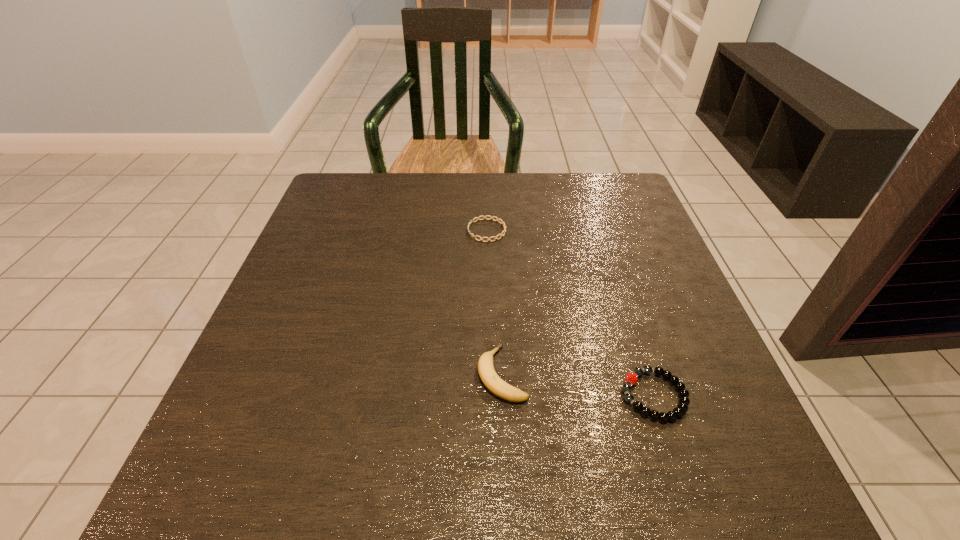
Identify the location of object at the far edge. Image resolution: width=960 pixels, height=540 pixels. (484, 217).

Where is `object that is at the right edge`? This screenshot has height=540, width=960. object that is at the right edge is located at coordinates (684, 401).

The width and height of the screenshot is (960, 540). In the image, there is a desktop. Find the location of `vacant space at the far edge`. vacant space at the far edge is located at coordinates (540, 177).

You are a GUI agent. You are given a task and a screenshot of the screen. Output one action in this format:
    pyautogui.click(x=<x>, y=<y>)
    Task: Click on the vacant space at the near edge
    
    Given the screenshot: What is the action you would take?
    pyautogui.click(x=400, y=454)

Locate an element on the screen. Image resolution: width=960 pixels, height=540 pixels. vacant space at the left edge is located at coordinates (299, 356).

Locate an element on the screen. vacant region at the right edge of the desktop is located at coordinates (693, 403).

Locate an element on the screen. The height and width of the screenshot is (540, 960). vacant space at the far left corner is located at coordinates (342, 172).

In the image, there is a desktop. At what (x,y) coordinates should I click in order to perform the action: click on free space at the near left corner. Please return your answer as a coordinate pair (x, y). Image resolution: width=960 pixels, height=540 pixels. Looking at the image, I should click on (241, 503).

This screenshot has width=960, height=540. I want to click on free spot between the second tallest object and the shorter bracelet, so (x=570, y=313).

The height and width of the screenshot is (540, 960). I want to click on free space between the taller bracelet and the shorter bracelet, so click(x=570, y=313).